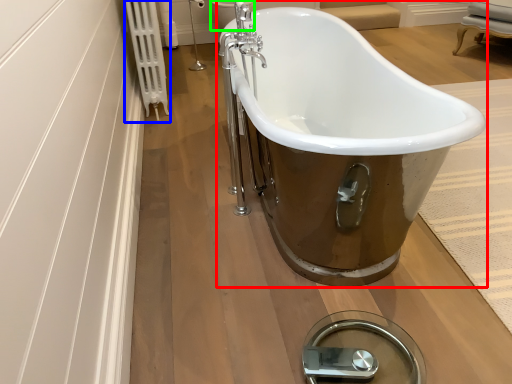
Question: Which object is the closest to the bathtub (highlighted by a red box)? Choose among these: radiator (highlighted by a blue box) or toilet bowl (highlighted by a green box).

Choices:
 (A) radiator
 (B) toilet bowl

Answer: (A)